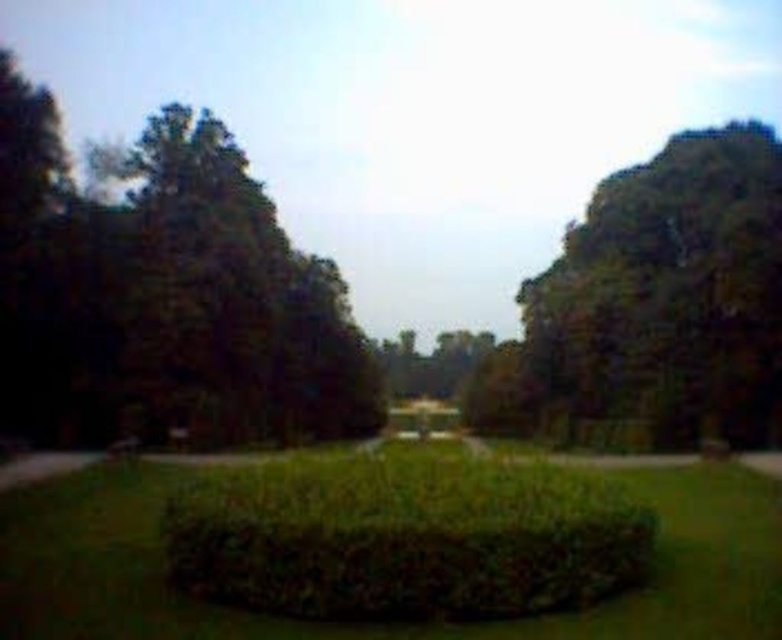
Can you confirm if green leafy tree at left is positioned to the left of green leafy bush at center?

Yes, green leafy tree at left is to the left of green leafy bush at center.

Does green leafy tree at left appear over green leafy bush at center?

Yes, green leafy tree at left is above green leafy bush at center.

What do you see at coordinates (164, 296) in the screenshot? I see `green leafy tree at left` at bounding box center [164, 296].

This screenshot has height=640, width=782. Find the location of `green leafy tree at left`. green leafy tree at left is located at coordinates (164, 296).

Between green leafy tree at left and green leafy tree at right, which one has more height?

green leafy tree at left

Does green leafy tree at left appear on the right side of green leafy tree at right?

No, green leafy tree at left is not to the right of green leafy tree at right.

Does point (303, 369) come in front of point (544, 316)?

That is False.

I want to click on green leafy tree at left, so click(164, 296).

Is green leafy tree at right above green leafy bush at center?

Yes.

Identify the location of green leafy tree at right. (669, 296).

Where is `green leafy tree at right`? green leafy tree at right is located at coordinates click(x=669, y=296).